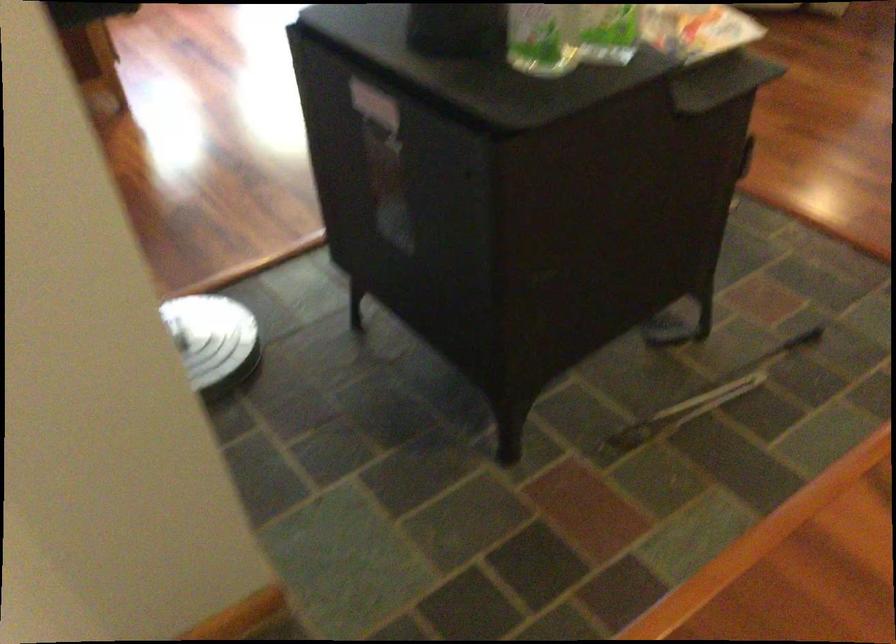
At what (x,y) coordinates should I click in order to perform the action: click on green plastic bottle. Please return your answer as a coordinate pair (x, y). Looking at the image, I should click on (541, 38).